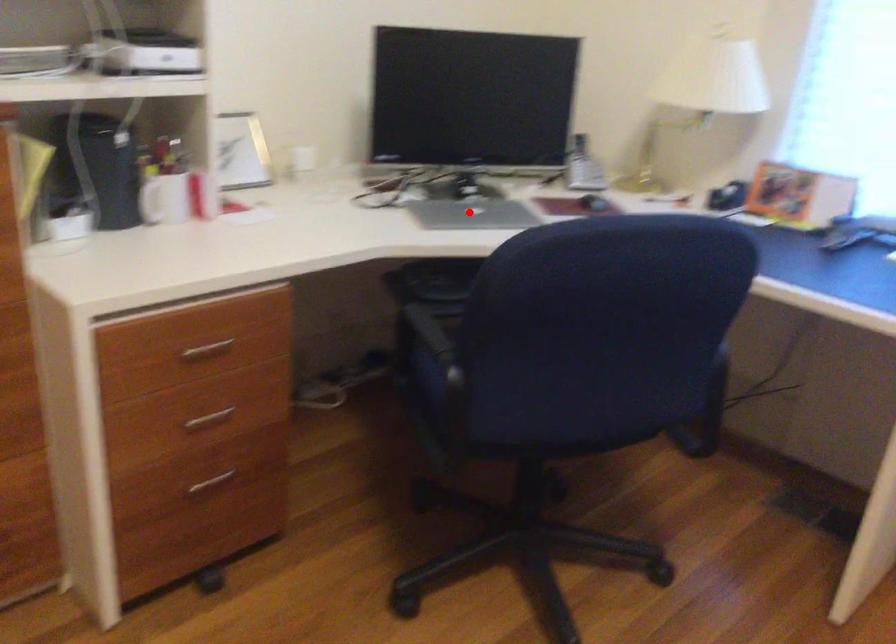
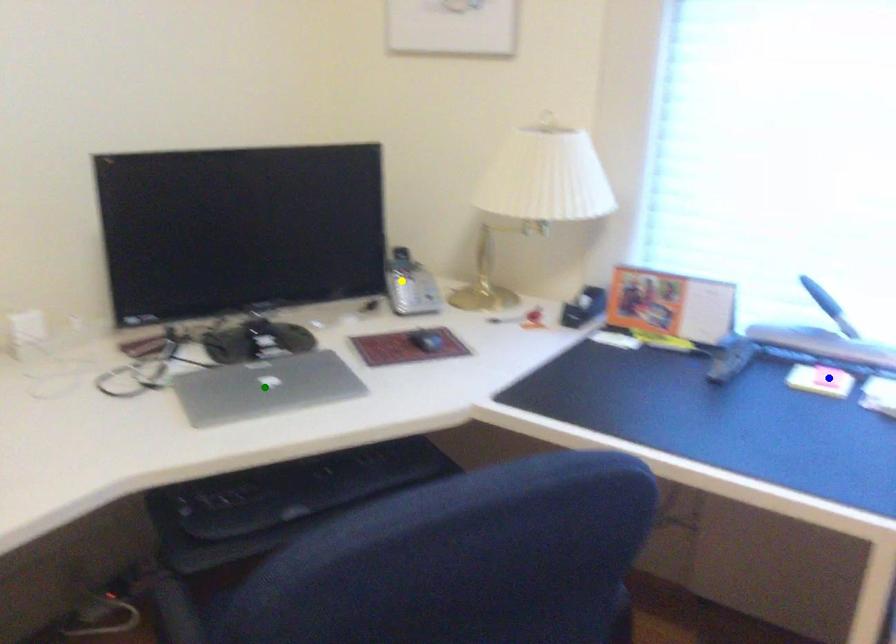
Question: I am providing you with two images of the same scene from different viewpoints. A red point is marked on the first image. You are given multiple points on the second image. Which point in image 2 represents the same 3d spot as the red point in image 1?

Choices:
 (A) green point
 (B) blue point
 (C) yellow point

Answer: (A)